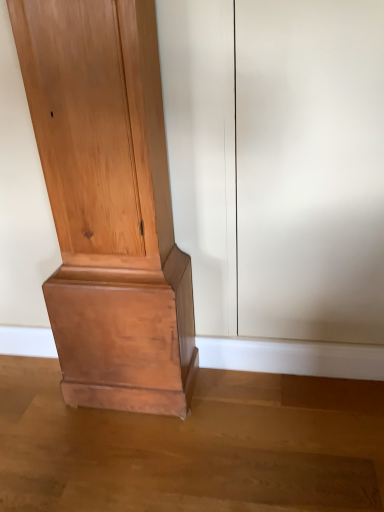
In order to face matte wood cabinet at left, should I rotate leftwards or rightwards?

It's best to rotate left around 10.832 degrees.

The width and height of the screenshot is (384, 512). Find the location of `matte wood cabinet at left`. matte wood cabinet at left is located at coordinates pos(108,203).

Image resolution: width=384 pixels, height=512 pixels. What do you see at coordinates (108, 203) in the screenshot?
I see `matte wood cabinet at left` at bounding box center [108, 203].

Locate an element on the screen. matte wood cabinet at left is located at coordinates (108, 203).